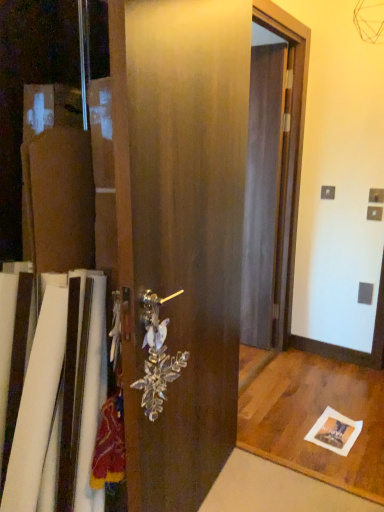
Question: Should I look upward or downward to see clear crystal door handle at center?

Choices:
 (A) down
 (B) up

Answer: (A)

Question: Does clear crystal door handle at center have a greater width compared to satin wood barn door at center?

Choices:
 (A) yes
 (B) no

Answer: (B)

Question: Is clear crystal door handle at center positioned with its back to satin wood barn door at center?

Choices:
 (A) no
 (B) yes

Answer: (B)

Question: From the image's perspective, is clear crystal door handle at center on satin wood barn door at center?

Choices:
 (A) no
 (B) yes

Answer: (A)

Question: Does clear crystal door handle at center turn towards satin wood barn door at center?

Choices:
 (A) yes
 (B) no

Answer: (A)

Question: From a real-world perspective, is clear crystal door handle at center physically above satin wood barn door at center?

Choices:
 (A) no
 (B) yes

Answer: (A)

Question: From a real-world perspective, is clear crystal door handle at center located beneath satin wood barn door at center?

Choices:
 (A) no
 (B) yes

Answer: (B)

Question: From the image's perspective, is transparent plastic screen door at center below satin wood barn door at center?

Choices:
 (A) no
 (B) yes

Answer: (A)

Question: Is transparent plastic screen door at center next to satin wood barn door at center and touching it?

Choices:
 (A) yes
 (B) no

Answer: (B)

Question: From the image's perspective, would you say transparent plastic screen door at center is positioned over satin wood barn door at center?

Choices:
 (A) yes
 (B) no

Answer: (A)

Question: From a real-world perspective, is transparent plastic screen door at center on satin wood barn door at center?

Choices:
 (A) yes
 (B) no

Answer: (A)

Question: Does transparent plastic screen door at center have a greater width compared to satin wood barn door at center?

Choices:
 (A) no
 (B) yes

Answer: (A)

Question: Is transparent plastic screen door at center closer to the viewer compared to satin wood barn door at center?

Choices:
 (A) no
 (B) yes

Answer: (A)

Question: From the image's perspective, is satin wood barn door at center above clear crystal door handle at center?

Choices:
 (A) yes
 (B) no

Answer: (A)